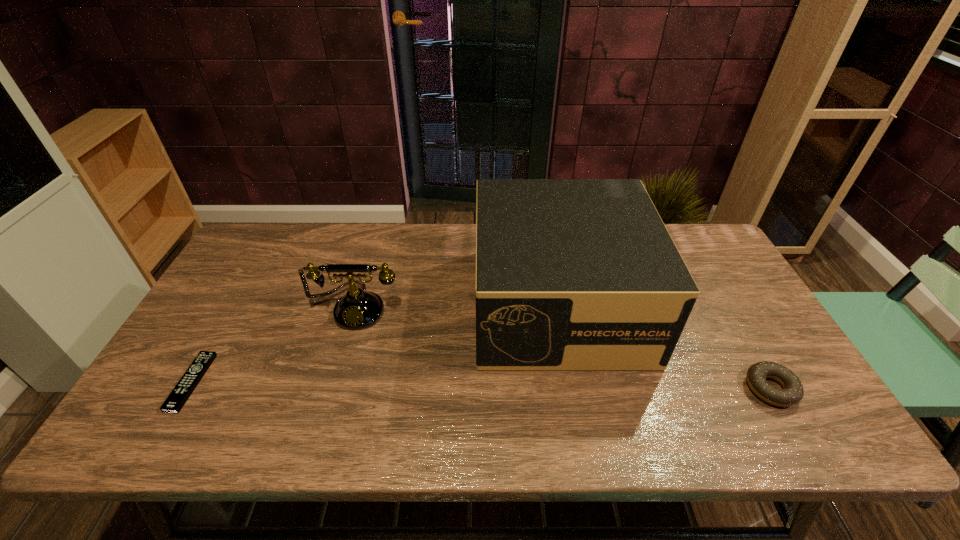
Identify the location of object that ranks as the second closest to the telephone. This screenshot has width=960, height=540. click(x=571, y=274).

Locate an element on the screen. object that is the closest one to the leftmost object is located at coordinates (357, 310).

Image resolution: width=960 pixels, height=540 pixels. I want to click on vacant space that satisfies the following two spatial constraints: 1. on the front-facing side of the doughnut; 2. on the left side of the tallest object, so click(574, 389).

Locate an element on the screen. free space in the image that satisfies the following two spatial constraints: 1. on the dial of the rightmost object; 2. on the right side of the telephone is located at coordinates tap(334, 389).

The image size is (960, 540). Find the location of `free point that satisfies the following two spatial constraints: 1. on the front-facing side of the second object from right to left; 2. on the left side of the rightmost object`. free point that satisfies the following two spatial constraints: 1. on the front-facing side of the second object from right to left; 2. on the left side of the rightmost object is located at coordinates (574, 389).

Where is `free point that satisfies the following two spatial constraints: 1. on the front side of the shortest object; 2. on the right side of the third tallest object`? Image resolution: width=960 pixels, height=540 pixels. free point that satisfies the following two spatial constraints: 1. on the front side of the shortest object; 2. on the right side of the third tallest object is located at coordinates (187, 389).